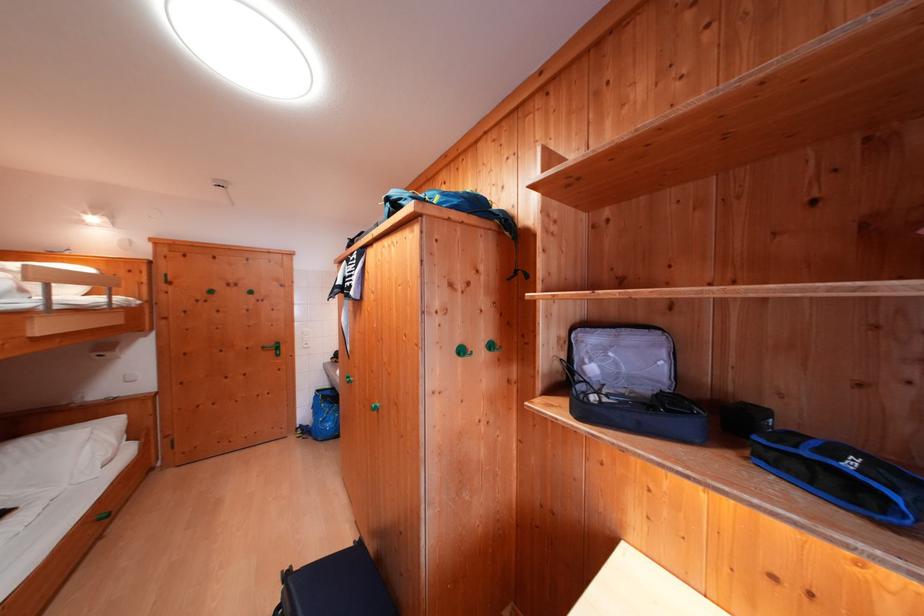
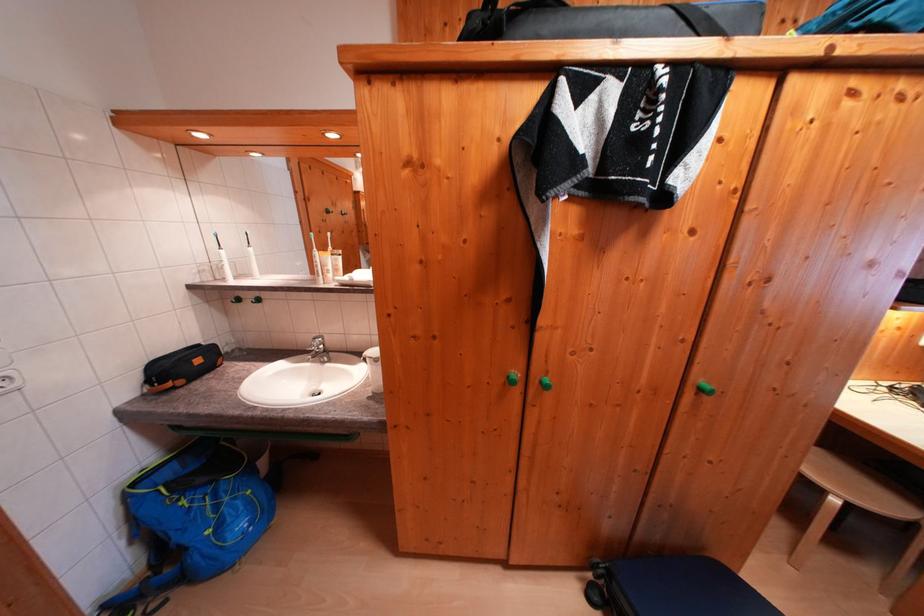
The point at (326,395) is marked in the first image. Where is the corresponding point in the second image?

(142, 488)